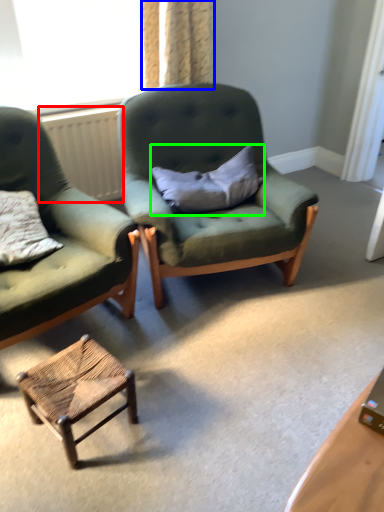
Question: Based on their relative distances, which object is farther from radiator (highlighted by a red box)? Choose from curtain (highlighted by a blue box) and pillow (highlighted by a green box).

Choices:
 (A) curtain
 (B) pillow

Answer: (B)